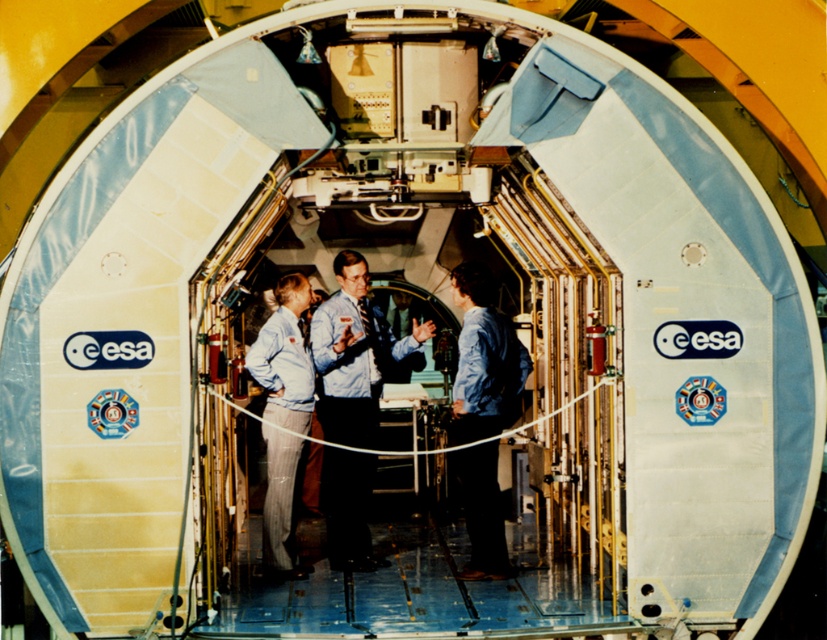
You are an astronaut inside the spacecraft and need to reach a control panel located at point (333, 554). There is also a safety lever at point (308, 301). Which object is closer to your current position?

Point (333, 554) is closer to the camera than point (308, 301), so the control panel at point (333, 554) is closer to your current position.

You are an astronaut trying to identify clothing items in the spacecraft. You see the blue denim shirt at center and the light blue fabric pants at center. Which clothing item is taller?

The blue denim shirt at center is much taller than the light blue fabric pants at center.

You are an astronaut preparing to exit the spacecraft through the circular opening. The airlock is located 20 feet away from the blue denim shirt at center. Can you safely reach the airlock before the oxygen runs out if you move at a speed of 2 feet per second?

The blue denim shirt at center is 34.37 feet away from the camera. The airlock is 20 feet away from the blue denim shirt at center, so the total distance from the camera to the airlock is 34.37 plus 20 equals 54.37 feet. At a speed of 2 feet per second, it would take 54.37 divided by 2 equals 27.185 seconds. Assuming the oxygen lasts longer than approximately 27 seconds, you can safely reach the airlock.